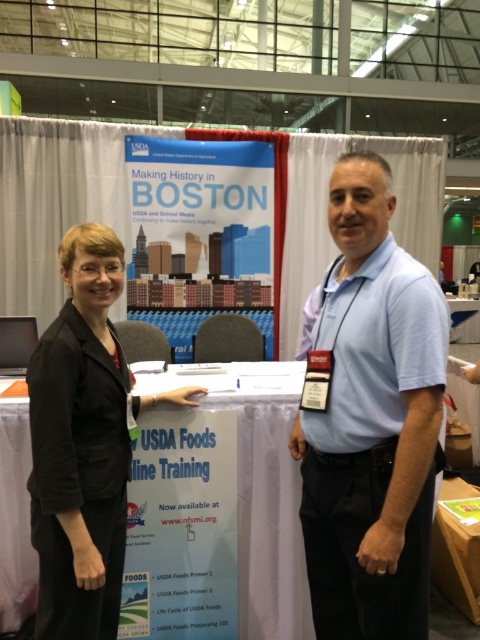
You are a photographer at the conference and need to adjust the camera focus. The light blue shirt at center and the black fabric suit at left are part of your subjects. Considering their distance, can you focus on both clearly at the same time?

The light blue shirt at center is 23.38 inches away from the black fabric shirt at left. Since the distance between them is relatively small, the camera can likely focus on both subjects clearly simultaneously.

You are attending a conference and see two people at a booth. One is wearing a light blue shirt at center and the other is in a black fabric suit at left. Which person is standing to the right of the other?

The light blue shirt at center is positioned on the right side of the black fabric suit at left, so the person in the light blue shirt at center is to the right of the person in the black fabric suit at left.

You are attending a conference and need to approach the two people at the booth. Which individual, the light blue shirt at center or the black fabric suit at left, would you reach first as you walk towards them?

You would reach the light blue shirt at center first because it is closer to the viewer than the black fabric suit at left.